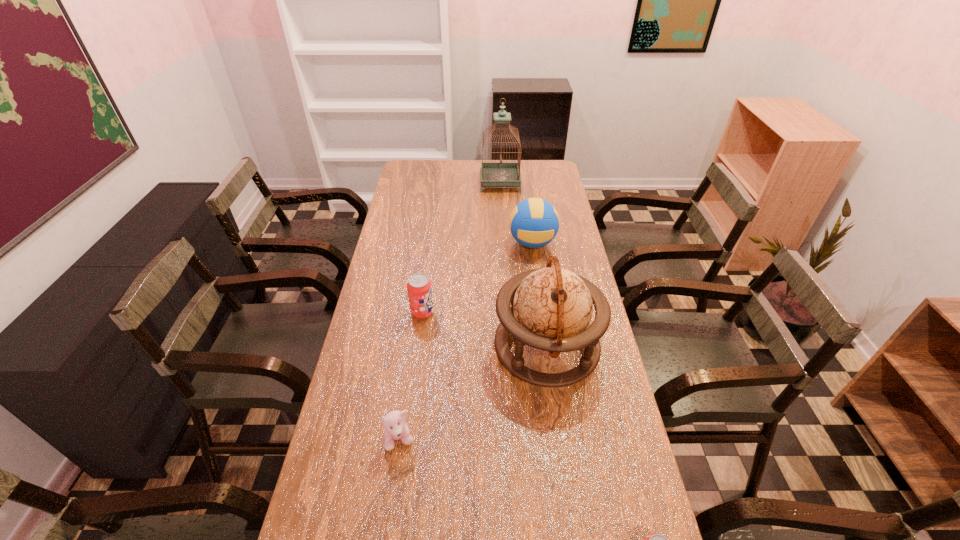
Where is `the tallest object`? The height and width of the screenshot is (540, 960). the tallest object is located at coordinates (493, 174).

Find the location of a particular element. This screenshot has width=960, height=540. birdcage is located at coordinates (493, 174).

At what (x,y) coordinates should I click in order to perform the action: click on globe. Please return your answer as a coordinate pair (x, y). The width and height of the screenshot is (960, 540). Looking at the image, I should click on (551, 308).

Where is `the fifth nearest object`? The width and height of the screenshot is (960, 540). the fifth nearest object is located at coordinates (534, 222).

Locate an element on the screen. The image size is (960, 540). the third tallest object is located at coordinates 534,222.

Find the location of a particular element. The image size is (960, 540). the taller soda can is located at coordinates [x=419, y=287].

Identify the location of the third shortest object. This screenshot has height=540, width=960. (419, 287).

Locate an element on the screen. The width and height of the screenshot is (960, 540). teddy bear is located at coordinates (395, 428).

Locate an element on the screen. The height and width of the screenshot is (540, 960). vacant space located at the door of the farthest object is located at coordinates (398, 181).

You are a GUI agent. You are given a task and a screenshot of the screen. Output one action in this format:
    pyautogui.click(x=<x>, y=<y>)
    Task: Click on the free spot located 0.320m at the door of the farthest object
    
    Given the screenshot: What is the action you would take?
    pos(411,181)